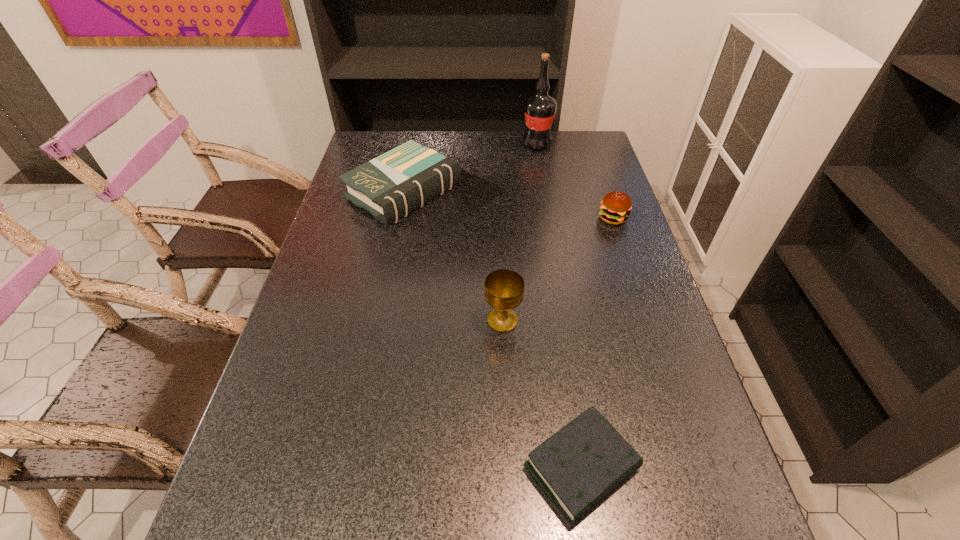
You are a GUI agent. You are given a task and a screenshot of the screen. Output one action in this format:
    pyautogui.click(x=<x>, y=<y>)
    Task: Click on the free space that is in between the wine bottle and the nearest object
    The image size is (960, 540).
    Given the screenshot: What is the action you would take?
    pyautogui.click(x=559, y=306)

This screenshot has height=540, width=960. I want to click on free point between the chalice and the paperback book, so click(x=453, y=256).

What are the coordinates of `free space between the chalice and the hamburger` in the screenshot? It's located at (558, 269).

Where is `object that can be found as the second closest to the second nearest object`? object that can be found as the second closest to the second nearest object is located at coordinates (395, 183).

Find the location of a particular element. This screenshot has width=960, height=540. object that can be found as the fourth closest to the wine bottle is located at coordinates (577, 467).

Find the location of a particular element. This screenshot has width=960, height=540. free space that satisfies the following two spatial constraints: 1. on the back side of the Bible; 2. on the right side of the farthest object is located at coordinates (531, 144).

Find the location of `vacant region that satisfies the following two spatial constraints: 1. on the front side of the nearest object; 2. on the right side of the second nearest object`. vacant region that satisfies the following two spatial constraints: 1. on the front side of the nearest object; 2. on the right side of the second nearest object is located at coordinates (509, 468).

Locate an element on the screen. The image size is (960, 540). vacant space that satisfies the following two spatial constraints: 1. on the front side of the rightmost object; 2. on the left side of the farthest object is located at coordinates (550, 218).

Image resolution: width=960 pixels, height=540 pixels. I want to click on vacant region that satisfies the following two spatial constraints: 1. on the front side of the leftmost object; 2. on the right side of the rightmost object, so coord(398,218).

Image resolution: width=960 pixels, height=540 pixels. I want to click on free space in the image that satisfies the following two spatial constraints: 1. on the back side of the chalice; 2. on the right side of the farthest object, so click(494, 144).